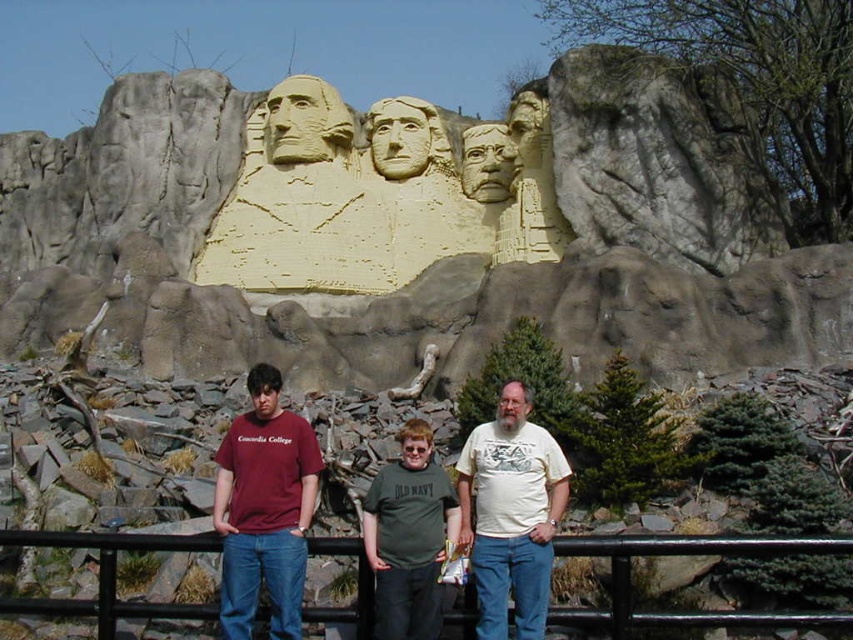
What do you see at coordinates (407, 232) in the screenshot? The height and width of the screenshot is (640, 853). I see `yellow sand sculpture at center` at bounding box center [407, 232].

Is yellow sand sculpture at center behind maroon t-shirt at center?

Yes, it is behind maroon t-shirt at center.

Does point (679, 196) come farther from viewer compared to point (279, 436)?

Yes.

Where is `yellow sand sculpture at center`? Image resolution: width=853 pixels, height=640 pixels. yellow sand sculpture at center is located at coordinates (407, 232).

In the scene shown: Who is positioned more to the left, white matte t-shirt at center or green cotton shirt at center?

green cotton shirt at center is more to the left.

Find the location of a particular element. The width and height of the screenshot is (853, 640). white matte t-shirt at center is located at coordinates (511, 515).

At what (x,y) coordinates should I click in order to perform the action: click on yellow sand sculpture at center. Please return your answer as a coordinate pair (x, y). Looking at the image, I should click on (407, 232).

Is point (236, 346) closer to camera compared to point (80, 609)?

No, it is not.

Is point (614, 176) in front of point (717, 621)?

That is False.

I want to click on yellow sand sculpture at center, so click(407, 232).